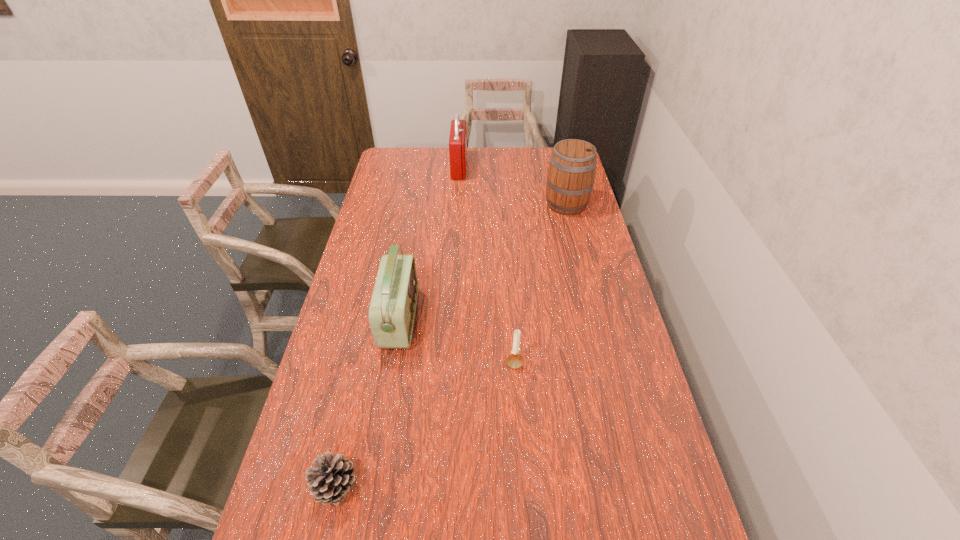
The width and height of the screenshot is (960, 540). What are the coordinates of `vacant region that satisfies the following two spatial constraints: 1. on the front panel of the candle holder; 2. on the right side of the radio receiver` in the screenshot? It's located at coord(393,363).

At what (x,y) coordinates should I click in order to perform the action: click on free location that satisfies the following two spatial constraints: 1. on the front side of the second farthest object; 2. on the front panel of the radio receiver. Please return your answer as a coordinate pair (x, y). The width and height of the screenshot is (960, 540). Looking at the image, I should click on (594, 319).

This screenshot has height=540, width=960. Identify the location of free point that satisfies the following two spatial constraints: 1. on the front panel of the radio receiver; 2. on the front side of the nearest object. coord(372,486).

Where is `free spot that satisfies the following two spatial constraints: 1. on the front face of the first-aid kit; 2. on the back side of the candle holder`? free spot that satisfies the following two spatial constraints: 1. on the front face of the first-aid kit; 2. on the back side of the candle holder is located at coordinates (446, 363).

This screenshot has width=960, height=540. I want to click on free space that satisfies the following two spatial constraints: 1. on the front face of the farthest object; 2. on the back side of the candle holder, so click(x=446, y=363).